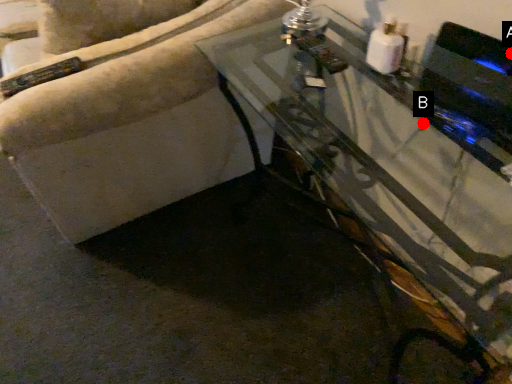
Question: Two points are circled on the image, labeled by A and B beside each circle. Which point is farther to the camera?

Choices:
 (A) A is further
 (B) B is further

Answer: (B)